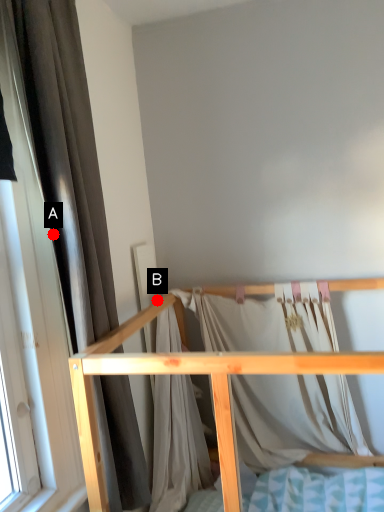
Question: Two points are circled on the image, labeled by A and B beside each circle. Among these points, which one is nearest to the camera?

Choices:
 (A) A is closer
 (B) B is closer

Answer: (A)